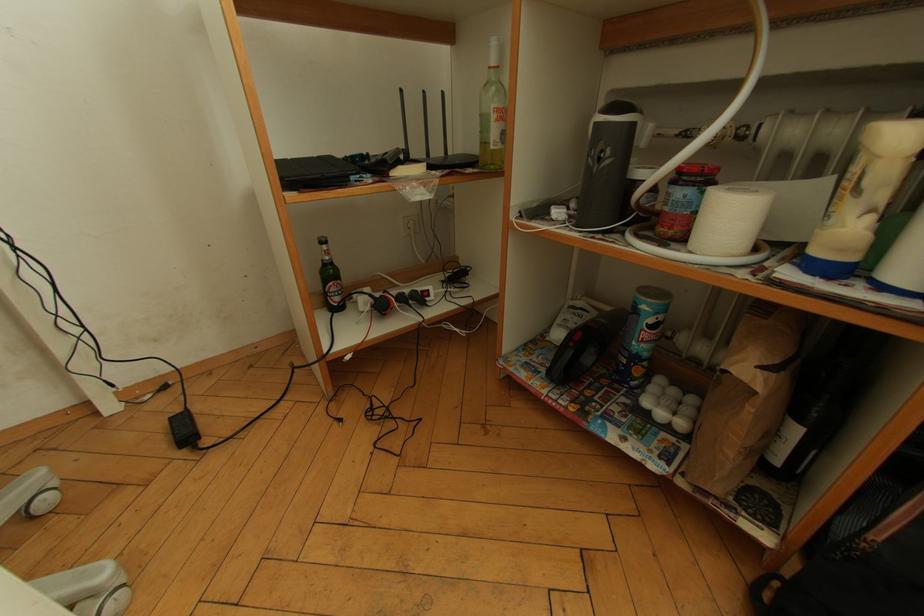
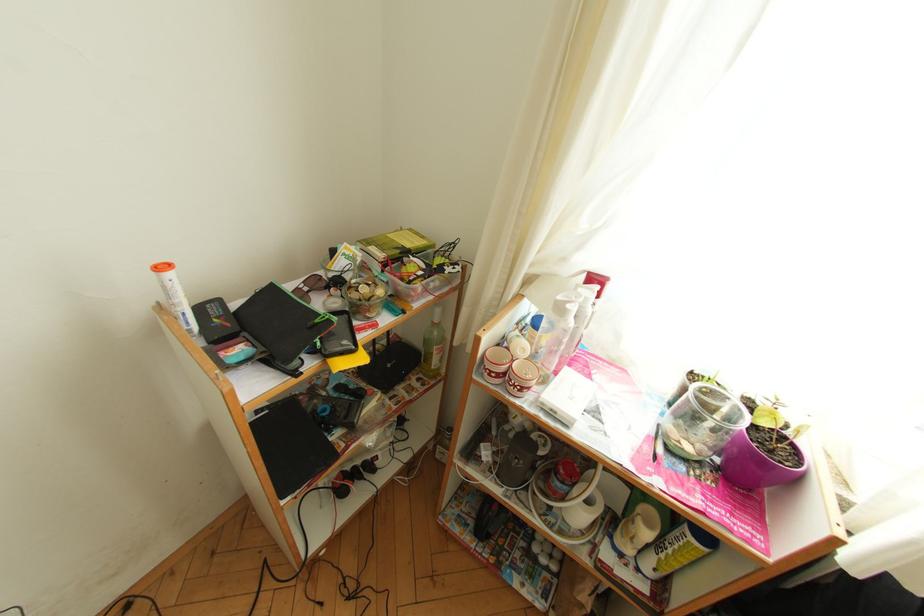
Question: The camera is either moving clockwise (left) or counter-clockwise (right) around the object. The first image is from the beginning of the video and the second image is from the end. Is the camera moving left or right when shooting the video?

Choices:
 (A) Left
 (B) Right

Answer: (A)